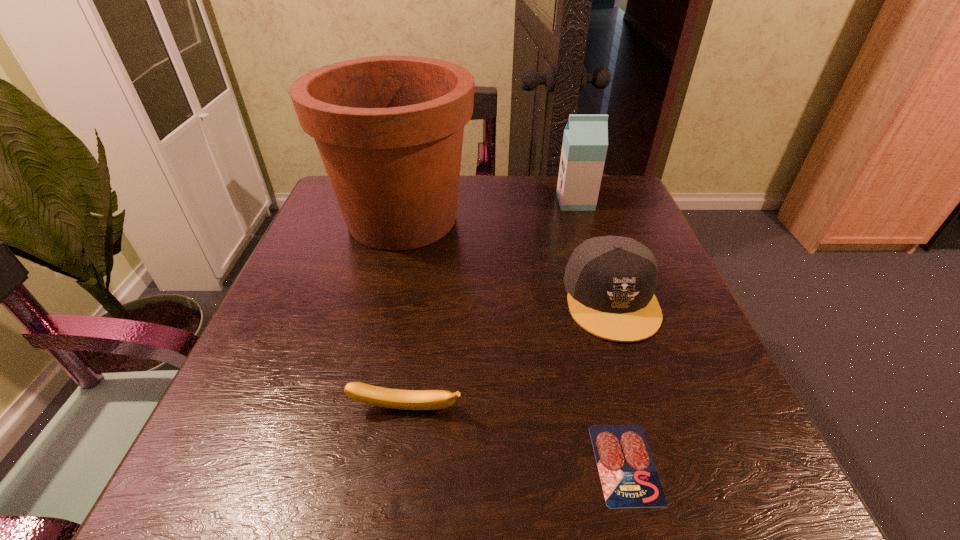
Find the location of a particular element. free space between the nearest object and the second shortest object is located at coordinates (516, 436).

Locate an element on the screen. free point between the second shortest object and the flowerpot is located at coordinates (404, 314).

Image resolution: width=960 pixels, height=540 pixels. Identify the location of vacant region between the second shortest object and the third tallest object. (509, 354).

Find the location of a particular element. vacant space that is in between the shortest object and the third shortest object is located at coordinates [618, 381].

Locate an element on the screen. This screenshot has height=540, width=960. free space that is in between the third tallest object and the flowerpot is located at coordinates (507, 259).

Locate an element on the screen. The image size is (960, 540). empty location between the shortest object and the cap is located at coordinates (618, 381).

Where is `unoccupied area between the milk carton and the banana`? This screenshot has width=960, height=540. unoccupied area between the milk carton and the banana is located at coordinates (491, 305).

Find the location of `object that is the third closest to the cap`. object that is the third closest to the cap is located at coordinates (585, 141).

Select which object appears as the fourth closest to the tallest object. Please provide its 2D coordinates. Your answer should be formatted as a tuple, i.e. [(x, y)], where the tuple contains the x and y coordinates of a point satisfying the conditions above.

[(629, 479)]

Identify the location of free location that satisfies the following two spatial constraints: 1. at the stem of the shortest object; 2. on the left side of the banana. 398,463.